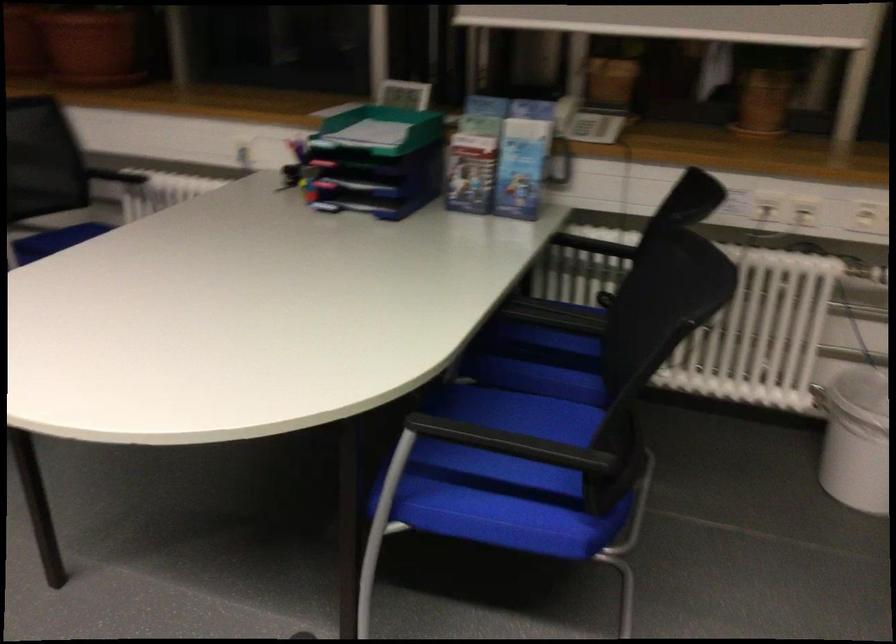
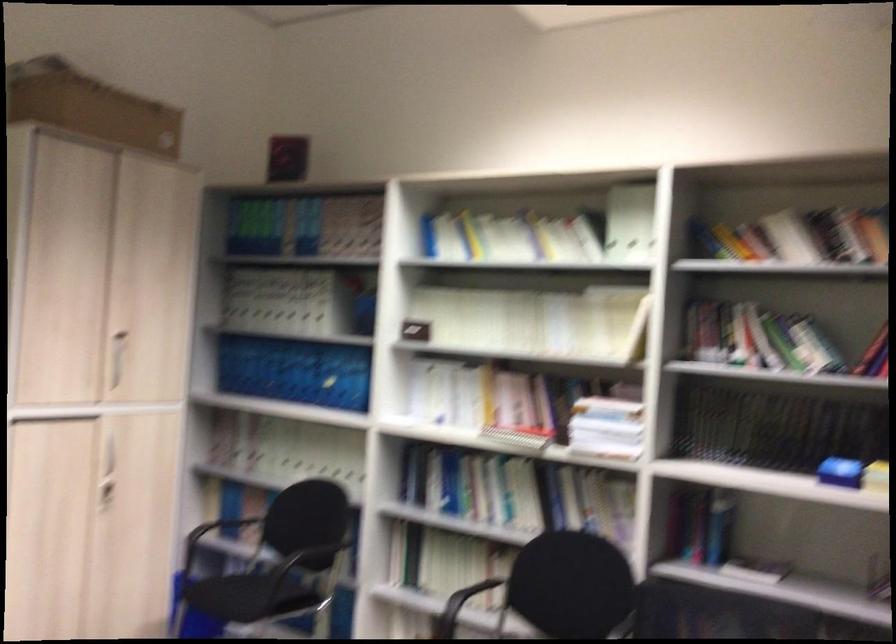
Question: How did the camera likely rotate?

Choices:
 (A) Left
 (B) Right
 (C) Up
 (D) Down

Answer: (A)